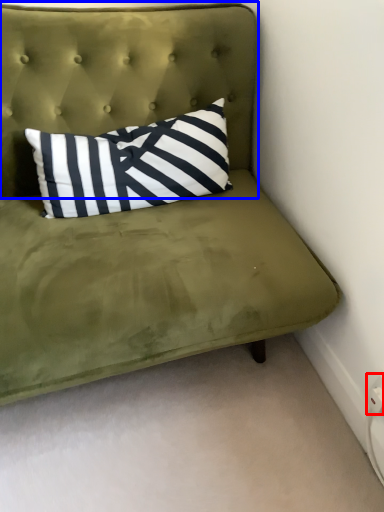
Question: Which object appears farthest to the camera in this image, electric outlet (highlighted by a red box) or headboard (highlighted by a blue box)?

Choices:
 (A) electric outlet
 (B) headboard

Answer: (A)